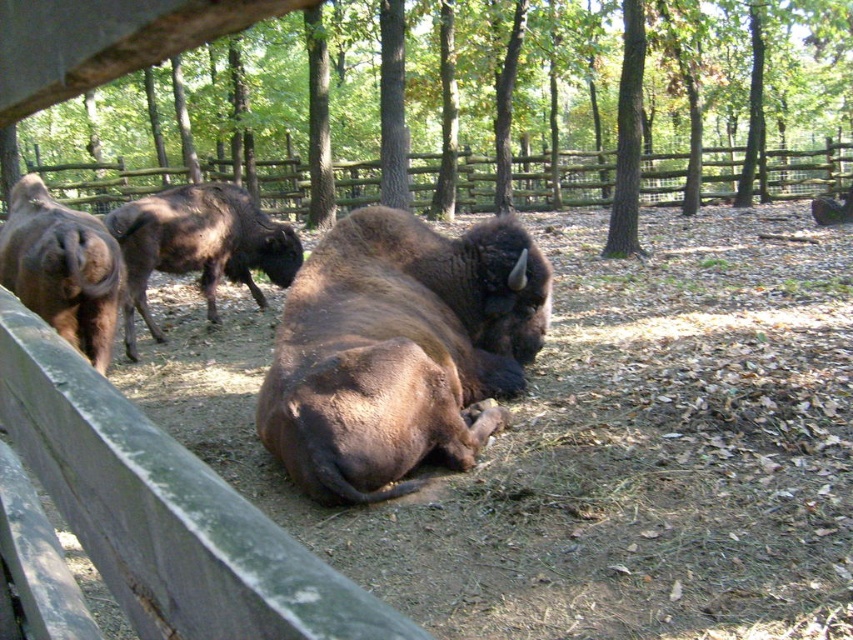
You are a wildlife photographer aiming to capture a photo of both the brown furry bison at center and the brown furry bison at left. Based on their positions, which bison is closer to the wooden fence in the foreground?

The brown furry bison at left is closer to the wooden fence in the foreground because it is positioned to the left of the brown furry bison at center, which is to the right of it.